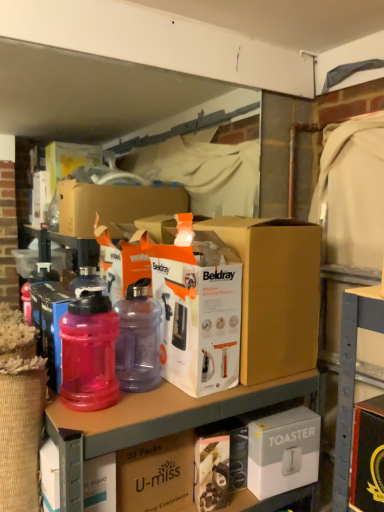
At what (x,y) coordinates should I click in order to perform the action: click on empty space that is to the right of pink translucent bottle at left, the first bottle viewed from the left. Please return your answer as a coordinate pair (x, y). Looking at the image, I should click on (160, 406).